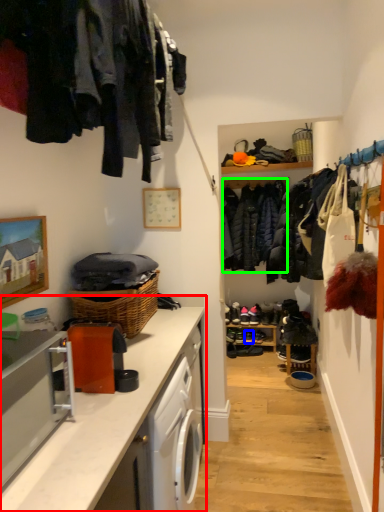
Question: Based on their relative distances, which object is farther from countertop (highlighted by a red box)? Choose from shoe (highlighted by a blue box) and clothing (highlighted by a green box).

Choices:
 (A) shoe
 (B) clothing

Answer: (A)